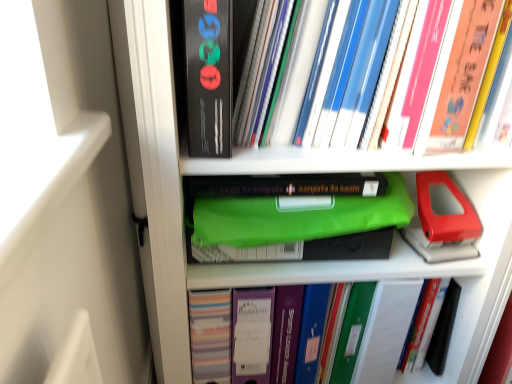
Question: Are matte black book at upper center and hardcover books at upper right, positioned as the second book in bottom-to-top order, beside each other?

Choices:
 (A) no
 (B) yes

Answer: (A)

Question: Is the depth of matte black book at upper center less than that of hardcover books at upper right, positioned as the second book in bottom-to-top order?

Choices:
 (A) no
 (B) yes

Answer: (B)

Question: Is matte black book at upper center aimed at hardcover books at upper right, placed as the 1th book when sorted from top to bottom?

Choices:
 (A) no
 (B) yes

Answer: (A)

Question: Is matte black book at upper center shorter than hardcover books at upper right, positioned as the second book in bottom-to-top order?

Choices:
 (A) no
 (B) yes

Answer: (A)

Question: Can you confirm if matte black book at upper center is thinner than hardcover books at upper right, placed as the 1th book when sorted from top to bottom?

Choices:
 (A) no
 (B) yes

Answer: (B)

Question: Considering the positions of matte plastic binder at center, marked as the 1th book in a bottom-to-top arrangement, and hardcover books at upper right, placed as the 1th book when sorted from top to bottom, in the image, is matte plastic binder at center, marked as the 1th book in a bottom-to-top arrangement, wider or thinner than hardcover books at upper right, placed as the 1th book when sorted from top to bottom,?

Choices:
 (A) wide
 (B) thin

Answer: (B)

Question: Is matte plastic binder at center, marked as the 1th book in a bottom-to-top arrangement, taller or shorter than hardcover books at upper right, positioned as the second book in bottom-to-top order?

Choices:
 (A) tall
 (B) short

Answer: (A)

Question: Considering their positions, is matte plastic binder at center, marked as the 1th book in a bottom-to-top arrangement, located in front of or behind hardcover books at upper right, positioned as the second book in bottom-to-top order?

Choices:
 (A) behind
 (B) front

Answer: (A)

Question: From the image's perspective, is matte plastic binder at center, which ranks as the 2th book in top-to-bottom order, above or below hardcover books at upper right, placed as the 1th book when sorted from top to bottom?

Choices:
 (A) above
 (B) below

Answer: (B)

Question: Is hardcover books at upper right, placed as the 1th book when sorted from top to bottom, taller or shorter than matte black book at upper center?

Choices:
 (A) tall
 (B) short

Answer: (B)

Question: Is point (385, 104) closer or farther from the camera than point (228, 81)?

Choices:
 (A) farther
 (B) closer

Answer: (A)

Question: From a real-world perspective, is hardcover books at upper right, placed as the 1th book when sorted from top to bottom, positioned above or below matte black book at upper center?

Choices:
 (A) below
 (B) above

Answer: (A)

Question: Would you say hardcover books at upper right, positioned as the second book in bottom-to-top order, is to the left or to the right of matte black book at upper center in the picture?

Choices:
 (A) right
 (B) left

Answer: (A)

Question: Is matte plastic binder at center, which ranks as the 2th book in top-to-bottom order, in front of or behind matte black book at upper center in the image?

Choices:
 (A) front
 (B) behind

Answer: (B)

Question: Is point (389, 359) closer or farther from the camera than point (200, 14)?

Choices:
 (A) closer
 (B) farther

Answer: (B)